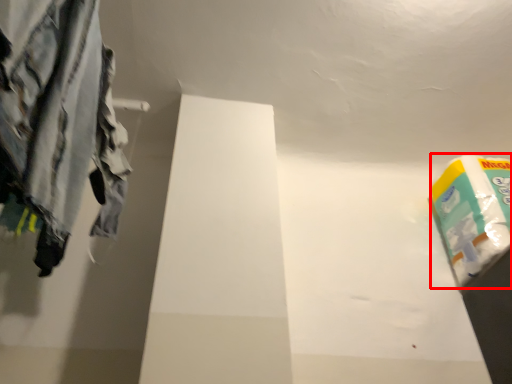
Question: Observing the image, what is the correct spatial positioning of toilet paper (annotated by the red box) in reference to trousers?

Choices:
 (A) right
 (B) left

Answer: (A)